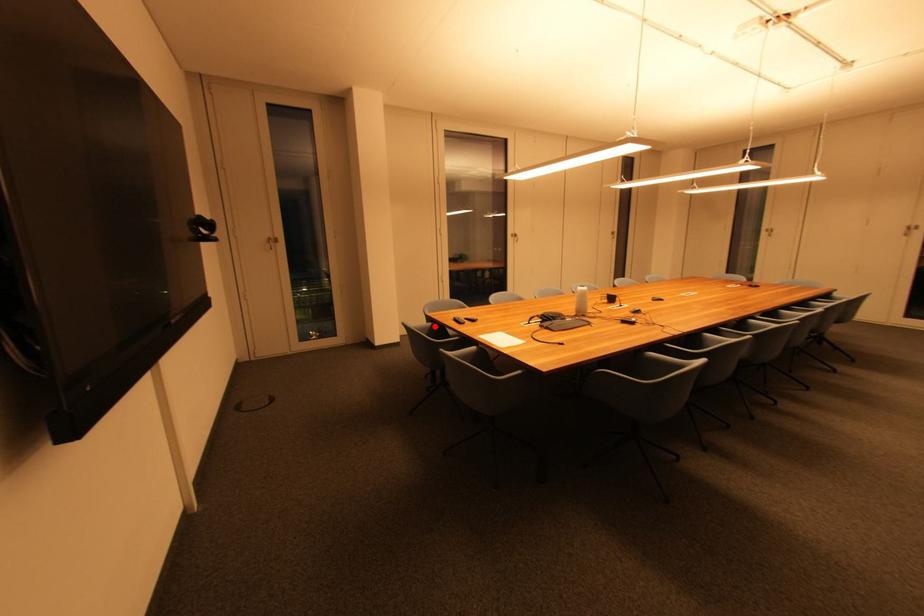
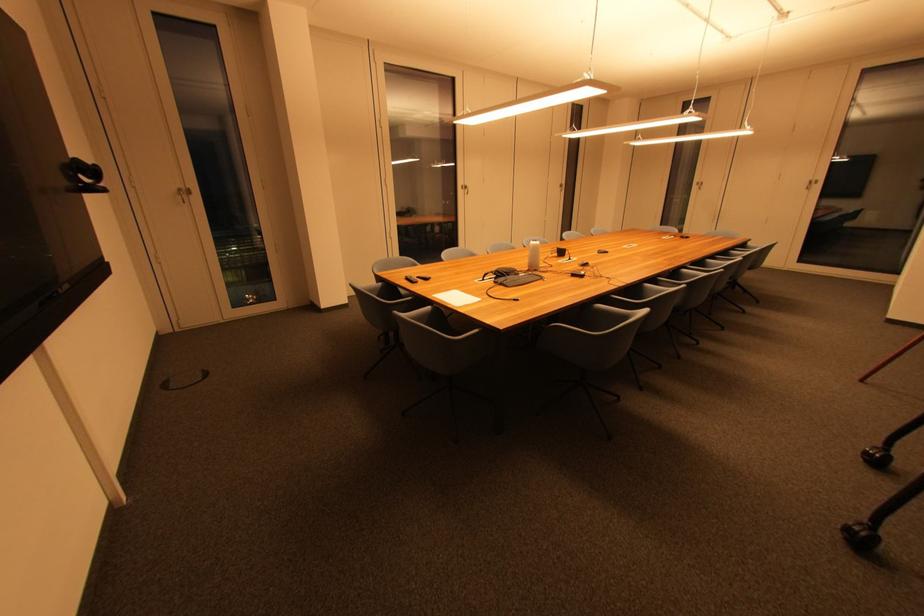
Question: I am providing you with two images of the same scene from different viewpoints. Given a red point in image1, look at the same physical point in image2. Is it:

Choices:
 (A) Closer to the viewpoint
 (B) Farther from the viewpoint

Answer: (A)